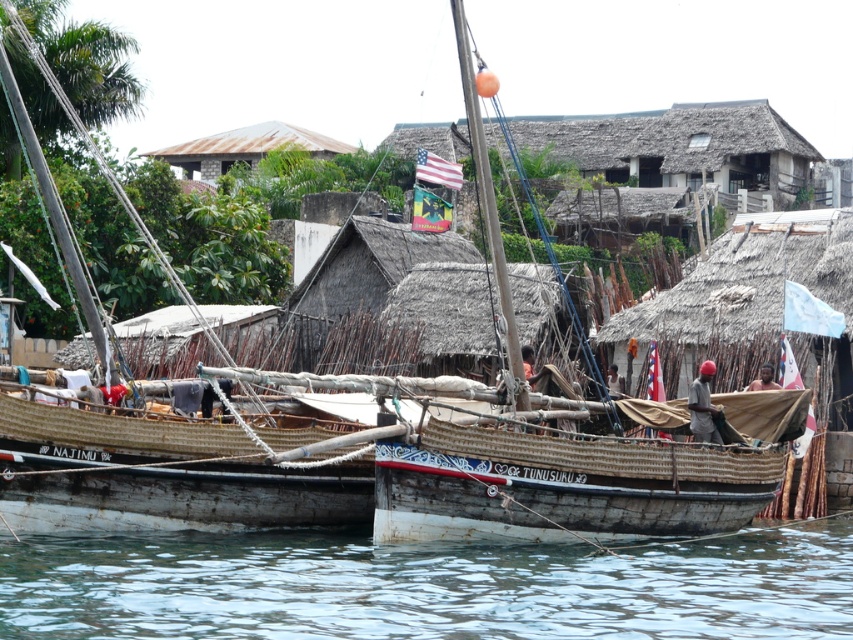
Does clear water at lower center come in front of rusty metal roof at upper center?

Yes, clear water at lower center is in front of rusty metal roof at upper center.

Who is higher up, clear water at lower center or rusty metal roof at upper center?

rusty metal roof at upper center is higher up.

Does point (612, 572) come closer to viewer compared to point (315, 152)?

That is True.

At what (x,y) coordinates should I click in order to perform the action: click on clear water at lower center. Please return your answer as a coordinate pair (x, y). This screenshot has height=640, width=853. Looking at the image, I should click on (428, 586).

Who is higher up, rusty wood boat at center or rusty metal roof at upper center?

rusty metal roof at upper center is higher up.

Locate an element on the screen. The image size is (853, 640). rusty wood boat at center is located at coordinates (173, 477).

Is clear water at lower center bigger than rusty wood boat at center?

Incorrect, clear water at lower center is not larger than rusty wood boat at center.

Which is in front, point (68, 561) or point (125, 449)?

Point (68, 561)

Find the location of a particular element. This screenshot has width=853, height=640. clear water at lower center is located at coordinates pos(428,586).